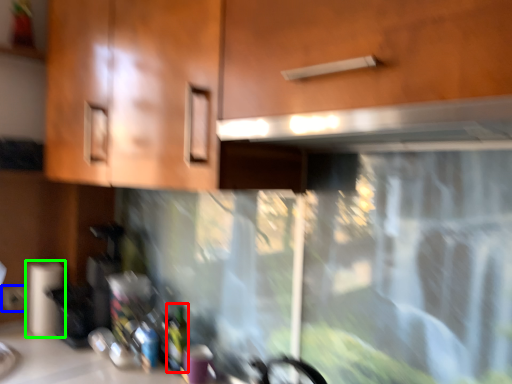
Question: Which object is the closest to the bottle (highlighted by a red box)? Choose among these: electric outlet (highlighted by a blue box) or paper towel (highlighted by a green box).

Choices:
 (A) electric outlet
 (B) paper towel

Answer: (B)